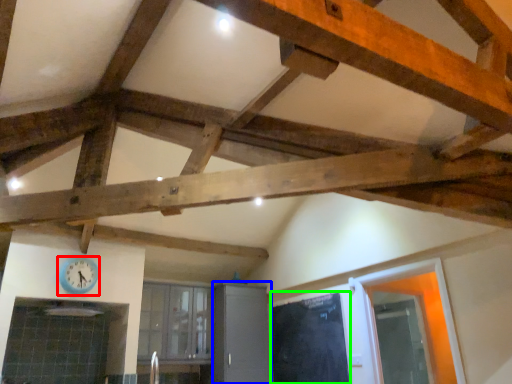
Question: Which object is the farthest from clock (highlighted by a red box)? Choose among these: cabinetry (highlighted by a blue box) or door (highlighted by a green box).

Choices:
 (A) cabinetry
 (B) door

Answer: (B)